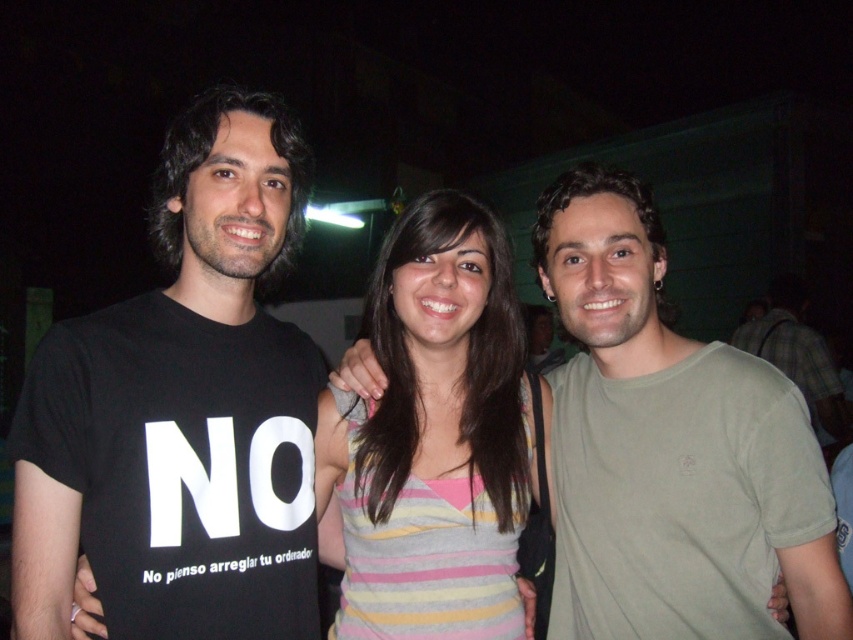
Does matte green t-shirt at center have a larger size compared to green cotton shirt at right?

Incorrect, matte green t-shirt at center is not larger than green cotton shirt at right.

Between matte green t-shirt at center and green cotton shirt at right, which one appears on the right side from the viewer's perspective?

Positioned to the right is green cotton shirt at right.

Does point (766, 545) come in front of point (801, 304)?

That is True.

Where is `matte green t-shirt at center`? The height and width of the screenshot is (640, 853). matte green t-shirt at center is located at coordinates (669, 445).

Does point (289, 404) come farther from viewer compared to point (590, 625)?

No, (289, 404) is closer to viewer.

Can you confirm if black cotton t-shirt at left is positioned above matte green t-shirt at center?

Yes.

Which is behind, point (169, 481) or point (639, 531)?

Positioned behind is point (639, 531).

The image size is (853, 640). Find the location of `black cotton t-shirt at left`. black cotton t-shirt at left is located at coordinates (183, 410).

Between matte green t-shirt at center and striped fabric shirt at center, which one appears on the left side from the viewer's perspective?

striped fabric shirt at center

The image size is (853, 640). Describe the element at coordinates (669, 445) in the screenshot. I see `matte green t-shirt at center` at that location.

Locate an element on the screen. This screenshot has height=640, width=853. matte green t-shirt at center is located at coordinates (669, 445).